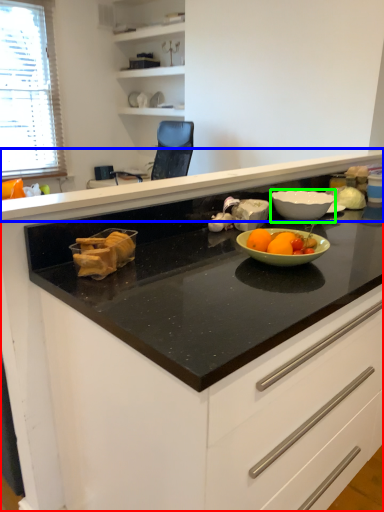
Question: Which object is positioned farthest from cabinetry (highlighted by a red box)? Select from countertop (highlighted by a blue box) and bowl (highlighted by a green box).

Choices:
 (A) countertop
 (B) bowl

Answer: (B)